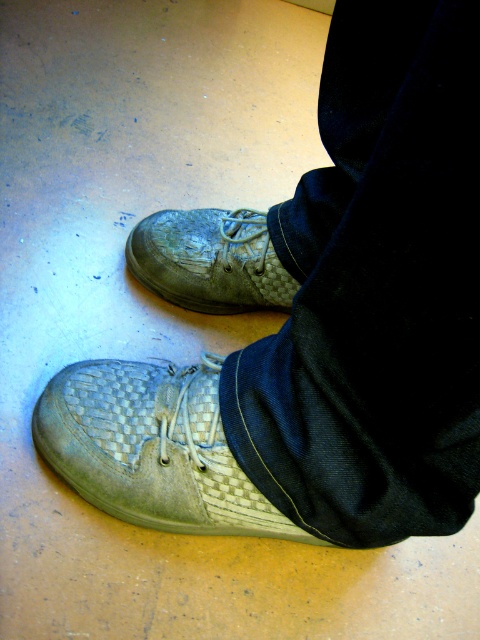
Does woven fabric shoe at lower center appear on the right side of worn leather shoe at center?

Incorrect, woven fabric shoe at lower center is not on the right side of worn leather shoe at center.

Where is `woven fabric shoe at lower center`? The width and height of the screenshot is (480, 640). woven fabric shoe at lower center is located at coordinates (153, 449).

Does point (92, 420) come farther from viewer compared to point (186, 216)?

No, it is in front of (186, 216).

You are a GUI agent. You are given a task and a screenshot of the screen. Output one action in this format:
    pyautogui.click(x=<x>, y=<y>)
    Task: Click on the woven fabric shoe at lower center
    This screenshot has height=640, width=480.
    Given the screenshot: What is the action you would take?
    pyautogui.click(x=153, y=449)